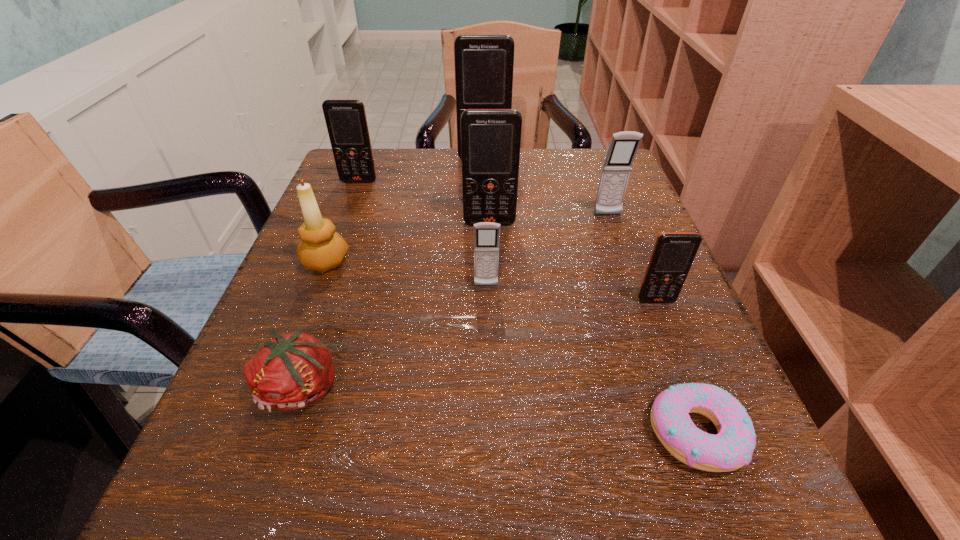
The height and width of the screenshot is (540, 960). What are the coordinates of `free location located 0.290m on the front of the candle_holder` in the screenshot? It's located at click(255, 442).

The width and height of the screenshot is (960, 540). What are the coordinates of `free space located on the screen of the smallest orange cellular telephone` in the screenshot? It's located at (742, 514).

The width and height of the screenshot is (960, 540). Find the location of `vacant space situated 0.240m on the front-facing side of the second nearest cellular telephone`. vacant space situated 0.240m on the front-facing side of the second nearest cellular telephone is located at coordinates (489, 425).

In order to click on vacant region located 0.090m on the right of the tomato in this screenshot , I will do `click(414, 387)`.

Where is `vacant area situated on the back of the doughnut`? vacant area situated on the back of the doughnut is located at coordinates (621, 236).

This screenshot has height=540, width=960. In order to click on object that is positioned at the near edge in this screenshot , I will do `click(732, 448)`.

In order to click on cellular telephone present at the left edge in this screenshot , I will do `click(346, 121)`.

Find the location of a particular element. The image size is (960, 540). candle_holder that is positioned at the left edge is located at coordinates (322, 248).

Find the location of a particular element. The height and width of the screenshot is (540, 960). tomato that is at the left edge is located at coordinates (293, 370).

Where is `doughnut positioned at the right edge`? Image resolution: width=960 pixels, height=540 pixels. doughnut positioned at the right edge is located at coordinates (732, 448).